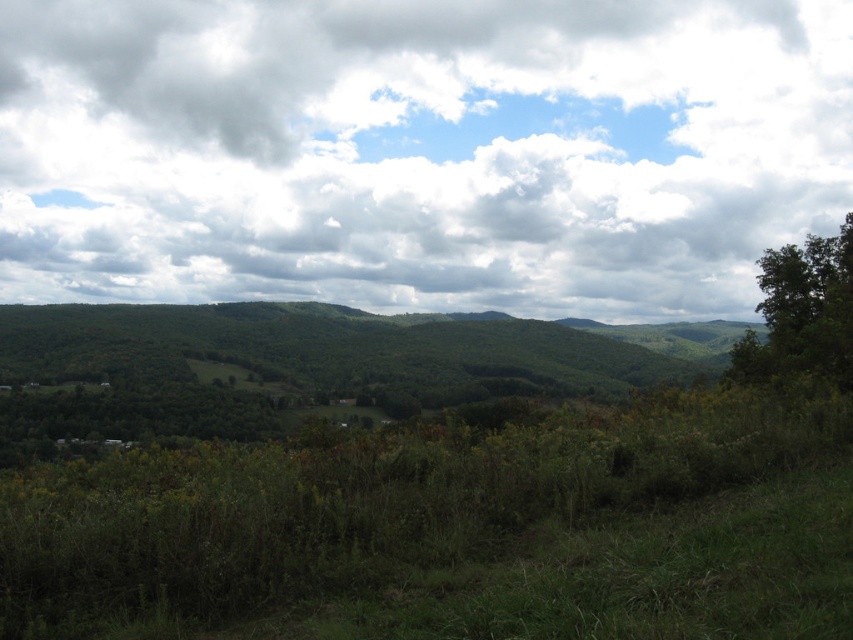
In the scene shown: Is white fluffy cloud at upper center above green leafy tree at right?

Indeed, white fluffy cloud at upper center is positioned over green leafy tree at right.

Which is behind, point (647, 88) or point (773, 276)?

Point (647, 88)

Where is `white fluffy cloud at upper center`? The width and height of the screenshot is (853, 640). white fluffy cloud at upper center is located at coordinates (419, 150).